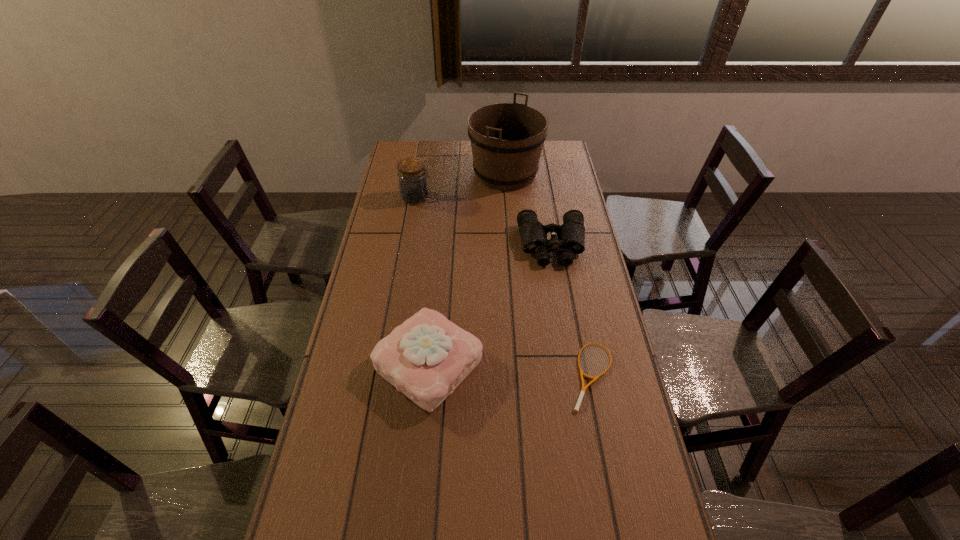
Locate an element on the screen. The image size is (960, 540). the tallest object is located at coordinates (507, 139).

Identify the location of jar. (413, 187).

Where is `the third tallest object`? the third tallest object is located at coordinates (426, 357).

Where is `the second shortest object`? This screenshot has width=960, height=540. the second shortest object is located at coordinates (570, 239).

Image resolution: width=960 pixels, height=540 pixels. In order to click on the third nearest object in this screenshot , I will do `click(570, 239)`.

Where is `tennis racket`? This screenshot has height=540, width=960. tennis racket is located at coordinates (576, 409).

Identify the location of free point located on the left of the tallest object. This screenshot has width=960, height=540. point(451,173).

Where is `vacant region located on the lid of the fourth shortest object`? vacant region located on the lid of the fourth shortest object is located at coordinates 452,198.

In order to click on free space located 0.160m on the right of the third shortest object in this screenshot , I will do `click(535, 364)`.

The width and height of the screenshot is (960, 540). Find the location of `vacant space located through the eyepieces of the third farthest object`. vacant space located through the eyepieces of the third farthest object is located at coordinates (559, 286).